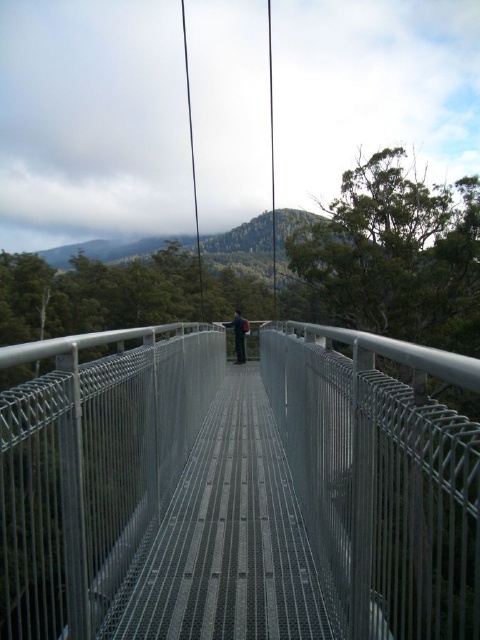
You are standing on the suspension bridge and want to reach a point marked at coordinates point (420, 408). If your walking speed is 3 feet per second, how long will it take you to reach that point?

The point (420, 408) is 5.35 feet away from the viewer. At a speed of 3 feet per second, it will take approximately 1.78 seconds to reach the point.

You are standing on the suspension bridge and want to know where the exact center of the bridge is located. Based on the coordinates provided, can you determine if the point at (x=381, y=477) is the center of the metallic gray bridge at center?

The metallic gray bridge at center is located at point (x=381, y=477), so yes, this coordinate marks the center of the bridge.

You are a hiker carrying a backpack and want to cross the metallic gray bridge at center. The backpack has a width of 0.5 meters. Can you safely pass through the bridge while carrying it?

The metallic gray bridge at center and viewer are 1.15 meters apart. Since the backpack is 0.5 meters wide, there is enough space to safely pass through the bridge while carrying it.